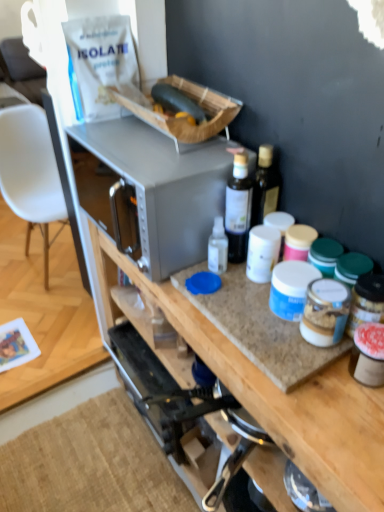
Where is `free space to the left of white plastic chair at left`? free space to the left of white plastic chair at left is located at coordinates (12, 254).